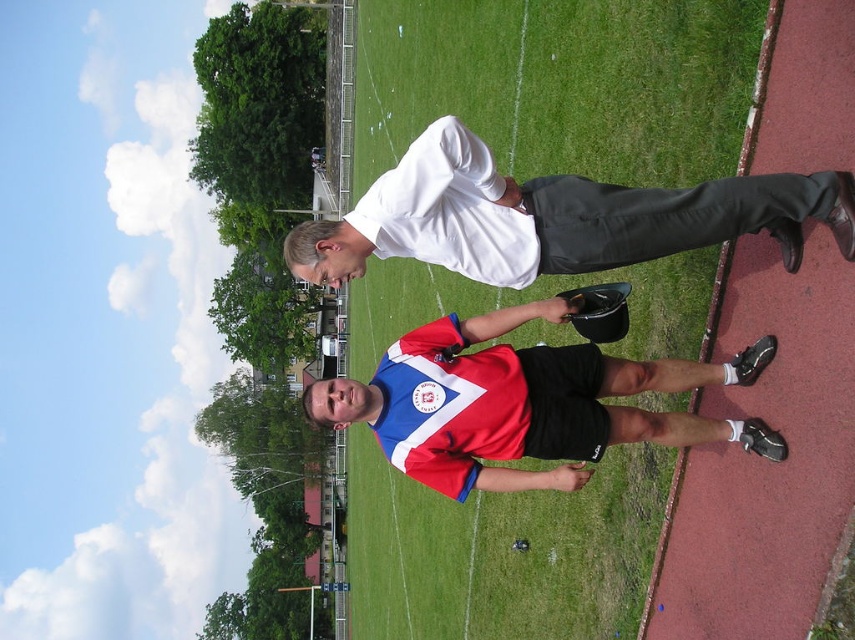
Is the position of white matte shirt at upper center more distant than that of red polyester jersey at center?

No, it is in front of red polyester jersey at center.

Does white matte shirt at upper center have a greater width compared to red polyester jersey at center?

Correct, the width of white matte shirt at upper center exceeds that of red polyester jersey at center.

Is point (313, 253) positioned before point (416, 406)?

No, (313, 253) is behind (416, 406).

This screenshot has width=855, height=640. In order to click on white matte shirt at upper center in this screenshot , I will do `click(546, 216)`.

Between red and white jersey at center and red polyester jersey at center, which one has more height?

Standing taller between the two is red and white jersey at center.

From the picture: Which is more to the right, red and white jersey at center or red polyester jersey at center?

red and white jersey at center

Is point (508, 468) positioned behind point (441, 416)?

Yes.

At what (x,y) coordinates should I click in order to perform the action: click on red and white jersey at center. Please return your answer as a coordinate pair (x, y). The image size is (855, 640). Looking at the image, I should click on (523, 403).

Which is above, green grass at center or red polyester jersey at center?

Positioned higher is green grass at center.

Who is lower down, green grass at center or red polyester jersey at center?

Result: red polyester jersey at center is lower down.

What do you see at coordinates (561, 83) in the screenshot? I see `green grass at center` at bounding box center [561, 83].

Image resolution: width=855 pixels, height=640 pixels. What are the coordinates of `green grass at center` in the screenshot? It's located at (561, 83).